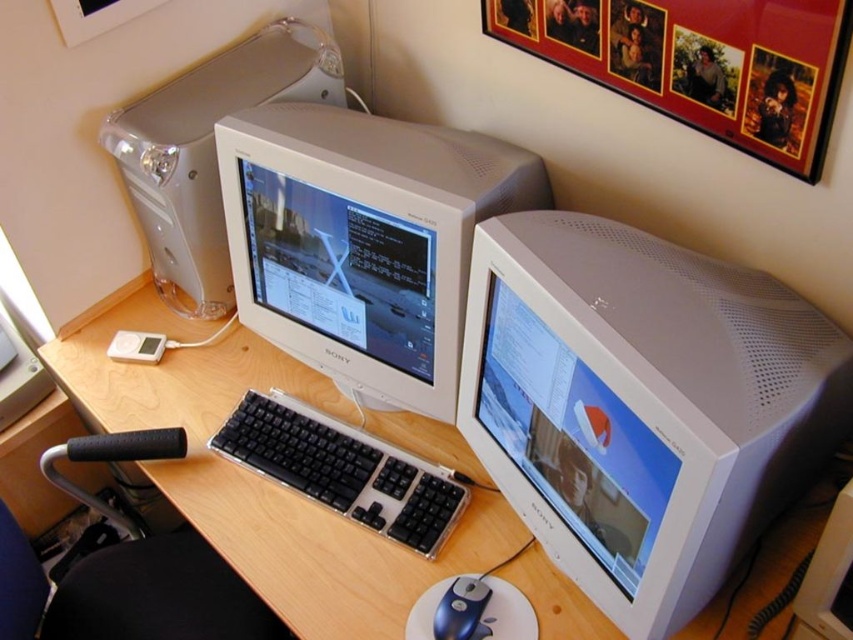
You are organizing your desk and need to move an item from the wooden desk at center to the black plastic keyboard at center. Which direction should you move the item?

The wooden desk at center is to the right of the black plastic keyboard at center, so you should move the item to the left to place it on the black plastic keyboard at center.

You are setting up a new desk and want to place the black plastic keyboard at center and the blue plastic mouse at lower center. Since space is limited, you need to know which item takes up more vertical space. Which object is taller?

The black plastic keyboard at center is taller than the blue plastic mouse at lower center according to the description.